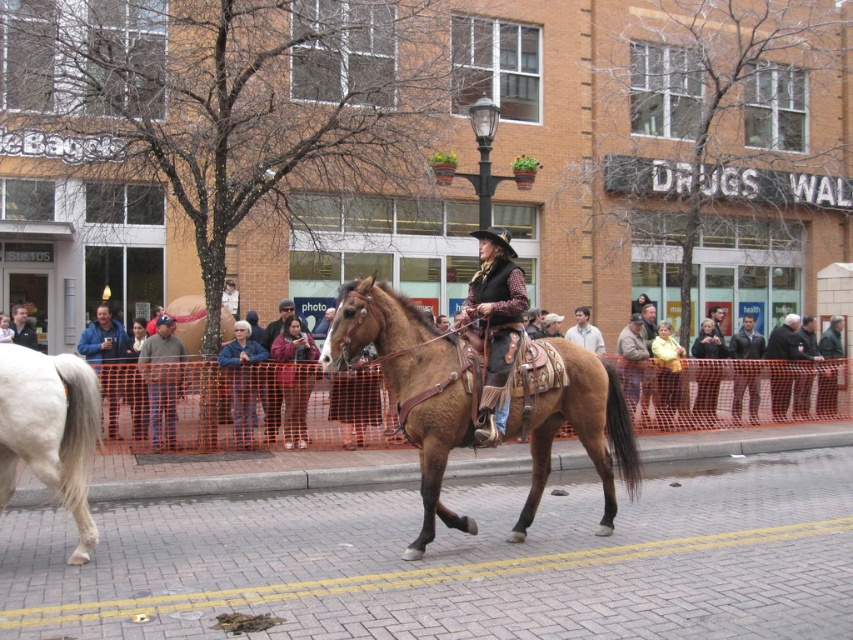
Question: Which point is farther to the camera?

Choices:
 (A) leather vest at center
 (B) leather jacket at center
 (C) blue denim jacket at center

Answer: (B)

Question: Can you confirm if leather vest at center is positioned below leather jacket at center?

Choices:
 (A) yes
 (B) no

Answer: (B)

Question: Based on their relative distances, which object is farther from the leather jacket at center?

Choices:
 (A) leather vest at center
 (B) blue denim jacket at center

Answer: (A)

Question: Is leather jacket at center smaller than blue denim jacket at center?

Choices:
 (A) yes
 (B) no

Answer: (B)

Question: Which object is the farthest from the brown leather horse at center?

Choices:
 (A) leather vest at center
 (B) blue denim jacket at center

Answer: (B)

Question: Does white glossy horse at left have a larger size compared to leather vest at center?

Choices:
 (A) yes
 (B) no

Answer: (A)